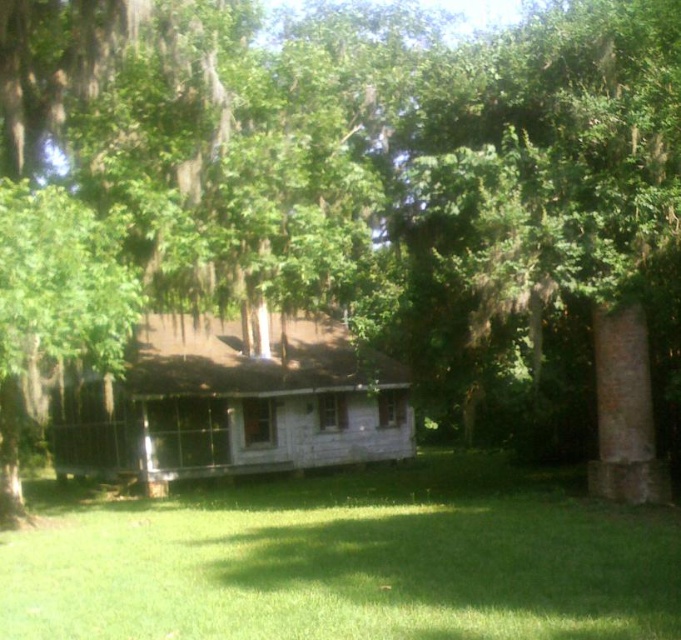
Question: Which point is closer to the camera taking this photo?

Choices:
 (A) (251, 458)
 (B) (646, 65)
 (C) (437, 465)

Answer: (B)

Question: Among these objects, which one is nearest to the camera?

Choices:
 (A) weathered wood porch at center
 (B) green mossy tree at center

Answer: (B)

Question: Which object is closer to the camera taking this photo?

Choices:
 (A) green grass at lower center
 (B) green mossy tree at center
 (C) weathered wood porch at center

Answer: (A)

Question: Can you confirm if green grass at lower center is wider than green mossy tree at center?

Choices:
 (A) no
 (B) yes

Answer: (B)

Question: Can you confirm if green grass at lower center is thinner than weathered wood porch at center?

Choices:
 (A) no
 (B) yes

Answer: (A)

Question: Does green grass at lower center appear on the left side of weathered wood porch at center?

Choices:
 (A) yes
 (B) no

Answer: (B)